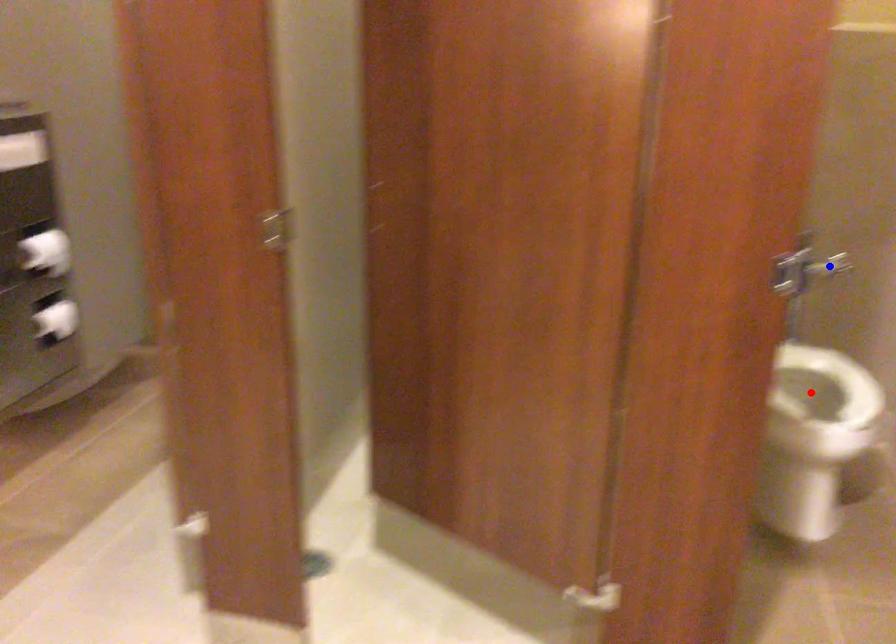
Question: In the image, two points are highlighted. Which point is nearer to the camera? Reply with the corresponding letter.

Choices:
 (A) blue point
 (B) red point

Answer: (B)